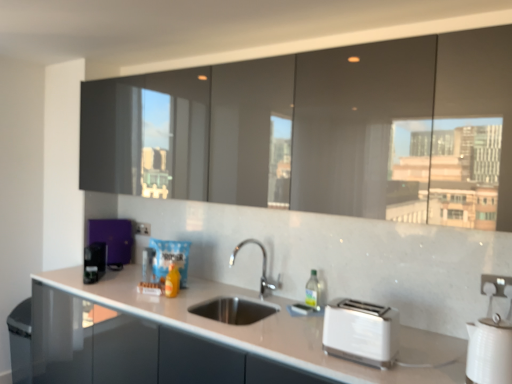
Find the location of a particular element. spots to the right of black plastic coffee machine at left, the second appliance from the left is located at coordinates (119, 276).